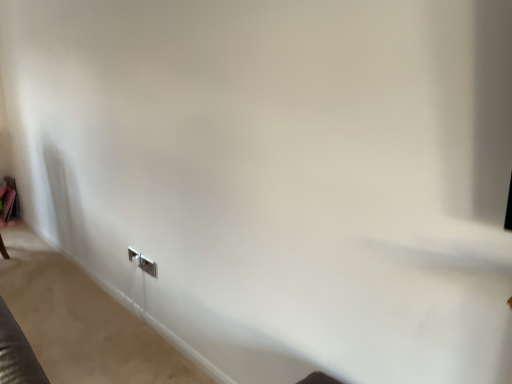
Question: Is white plastic electric outlet at lower center, which ranks as the first electric outlet in front-to-back order, taller or shorter than white plastic electric outlet at lower left, which appears as the first electric outlet when viewed from the left?

Choices:
 (A) short
 (B) tall

Answer: (B)

Question: Is white plastic electric outlet at lower center, the 1th electric outlet viewed from the right, inside or outside of white plastic electric outlet at lower left, acting as the 2th electric outlet starting from the right?

Choices:
 (A) outside
 (B) inside

Answer: (A)

Question: Considering the positions of white plastic electric outlet at lower center, positioned as the 2th electric outlet in back-to-front order, and white plastic electric outlet at lower left, placed as the second electric outlet when sorted from front to back, in the image, is white plastic electric outlet at lower center, positioned as the 2th electric outlet in back-to-front order, bigger or smaller than white plastic electric outlet at lower left, placed as the second electric outlet when sorted from front to back,?

Choices:
 (A) big
 (B) small

Answer: (B)

Question: Does point (128, 251) appear closer or farther from the camera than point (139, 258)?

Choices:
 (A) closer
 (B) farther

Answer: (B)

Question: Would you say white plastic electric outlet at lower left, acting as the 2th electric outlet starting from the right, is inside or outside white plastic electric outlet at lower center, which ranks as the first electric outlet in front-to-back order?

Choices:
 (A) outside
 (B) inside

Answer: (A)

Question: Relative to white plastic electric outlet at lower center, which ranks as the first electric outlet in front-to-back order, is white plastic electric outlet at lower left, which ranks as the 1th electric outlet in back-to-front order, in front or behind?

Choices:
 (A) behind
 (B) front

Answer: (A)

Question: Would you say white plastic electric outlet at lower left, which ranks as the 1th electric outlet in back-to-front order, is to the left or to the right of white plastic electric outlet at lower center, arranged as the 2th electric outlet when viewed from the left, in the picture?

Choices:
 (A) right
 (B) left

Answer: (B)